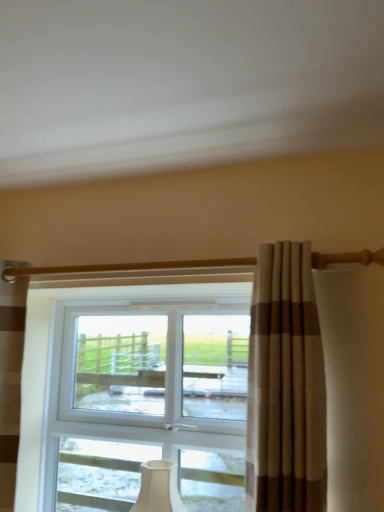
Question: Can you confirm if beige striped curtain at center, which is the 1th curtain from front to back, is thinner than brown striped curtain at left, which is counted as the 1th curtain, starting from the back?

Choices:
 (A) no
 (B) yes

Answer: (A)

Question: From a real-world perspective, is beige striped curtain at center, which is counted as the second curtain, starting from the back, positioned under brown striped curtain at left, marked as the 1th curtain in a left-to-right arrangement, based on gravity?

Choices:
 (A) yes
 (B) no

Answer: (B)

Question: Is beige striped curtain at center, which is counted as the second curtain, starting from the left, positioned in front of brown striped curtain at left, marked as the 2th curtain in a right-to-left arrangement?

Choices:
 (A) no
 (B) yes

Answer: (B)

Question: Could you tell me if beige striped curtain at center, the first curtain positioned from the right, is facing brown striped curtain at left, which is counted as the 1th curtain, starting from the back?

Choices:
 (A) yes
 (B) no

Answer: (B)

Question: Can you confirm if beige striped curtain at center, which is the 1th curtain from front to back, is wider than brown striped curtain at left, marked as the 2th curtain in a right-to-left arrangement?

Choices:
 (A) yes
 (B) no

Answer: (A)

Question: Considering the positions of white matte table lamp at center and beige striped curtain at center, which is the 1th curtain from front to back, in the image, is white matte table lamp at center wider or thinner than beige striped curtain at center, which is the 1th curtain from front to back,?

Choices:
 (A) wide
 (B) thin

Answer: (B)

Question: In the image, is white matte table lamp at center on the left side or the right side of beige striped curtain at center, which is counted as the second curtain, starting from the left?

Choices:
 (A) left
 (B) right

Answer: (A)

Question: From a real-world perspective, is white matte table lamp at center physically located above or below beige striped curtain at center, which is counted as the second curtain, starting from the left?

Choices:
 (A) above
 (B) below

Answer: (B)

Question: Considering the positions of point (185, 510) and point (271, 349), is point (185, 510) closer or farther from the camera than point (271, 349)?

Choices:
 (A) farther
 (B) closer

Answer: (A)

Question: In terms of size, does brown striped curtain at left, marked as the 1th curtain in a left-to-right arrangement, appear bigger or smaller than white matte table lamp at center?

Choices:
 (A) big
 (B) small

Answer: (A)

Question: Visually, is brown striped curtain at left, placed as the second curtain when sorted from front to back, positioned to the left or to the right of white matte table lamp at center?

Choices:
 (A) left
 (B) right

Answer: (A)

Question: Is brown striped curtain at left, which is counted as the 1th curtain, starting from the back, wider or thinner than white matte table lamp at center?

Choices:
 (A) thin
 (B) wide

Answer: (A)

Question: In the image, is brown striped curtain at left, which is counted as the 1th curtain, starting from the back, positioned in front of or behind white matte table lamp at center?

Choices:
 (A) front
 (B) behind

Answer: (A)

Question: From a real-world perspective, is beige striped curtain at center, which is the 1th curtain from front to back, physically located above or below white matte table lamp at center?

Choices:
 (A) above
 (B) below

Answer: (A)

Question: Is beige striped curtain at center, which is counted as the second curtain, starting from the left, wider or thinner than white matte table lamp at center?

Choices:
 (A) thin
 (B) wide

Answer: (B)